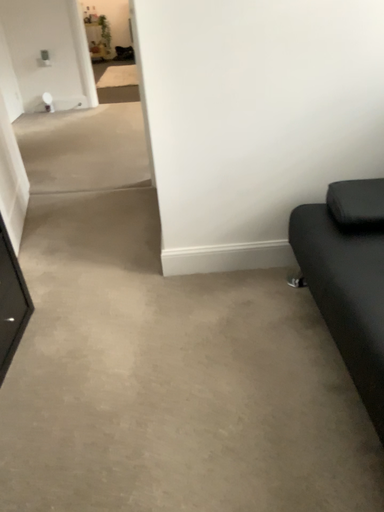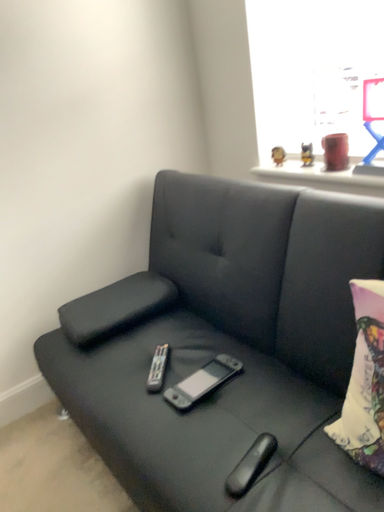
Question: How did the camera likely rotate when shooting the video?

Choices:
 (A) rotated upward
 (B) rotated downward

Answer: (A)